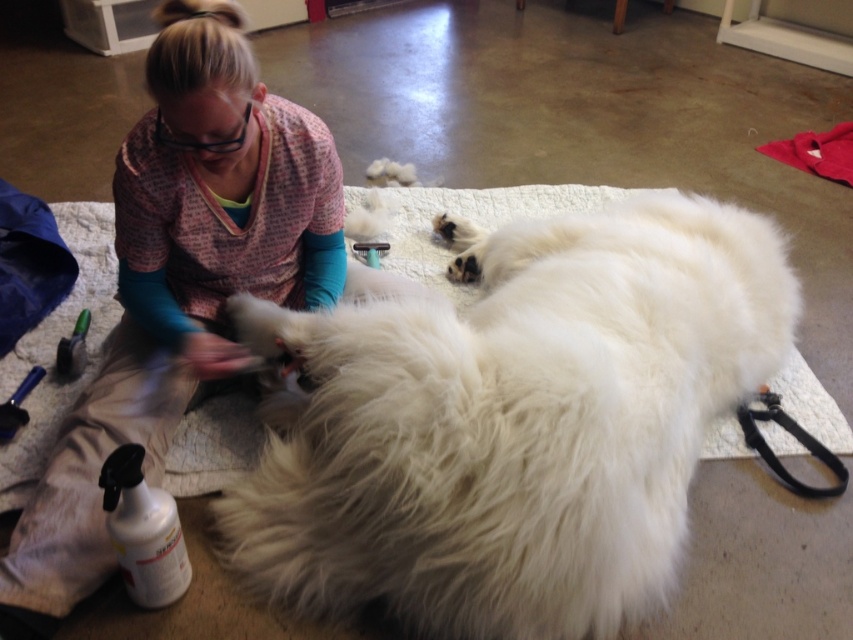
Is white fluffy dog at center above black rubber leash at lower right?

Yes.

Does point (621, 592) come closer to viewer compared to point (781, 417)?

That is True.

Who is more forward, (599, 381) or (766, 387)?

Positioned in front is point (599, 381).

Locate an element on the screen. This screenshot has height=640, width=853. white fluffy dog at center is located at coordinates pyautogui.click(x=512, y=422).

In the scene shown: Is pink fabric at center bigger than black rubber leash at lower right?

Indeed, pink fabric at center has a larger size compared to black rubber leash at lower right.

Find the location of a particular element. pink fabric at center is located at coordinates (183, 275).

Who is more forward, (x=158, y=52) or (x=757, y=435)?

Positioned in front is point (x=158, y=52).

Locate an element on the screen. pink fabric at center is located at coordinates (183, 275).

Is white fluffy dog at center closer to camera compared to pink fabric at center?

Yes, white fluffy dog at center is in front of pink fabric at center.

What do you see at coordinates (512, 422) in the screenshot? Image resolution: width=853 pixels, height=640 pixels. I see `white fluffy dog at center` at bounding box center [512, 422].

In order to click on white fluffy dog at center in this screenshot , I will do `click(512, 422)`.